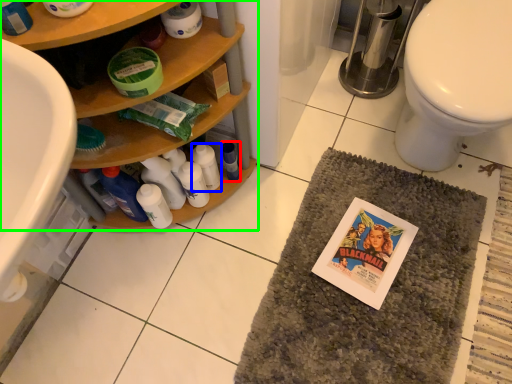
Question: Based on their relative distances, which object is farther from bottle (highlighted by a red box)? Choose from bottle (highlighted by a blue box) and bathroom cabinet (highlighted by a green box).

Choices:
 (A) bottle
 (B) bathroom cabinet

Answer: (B)